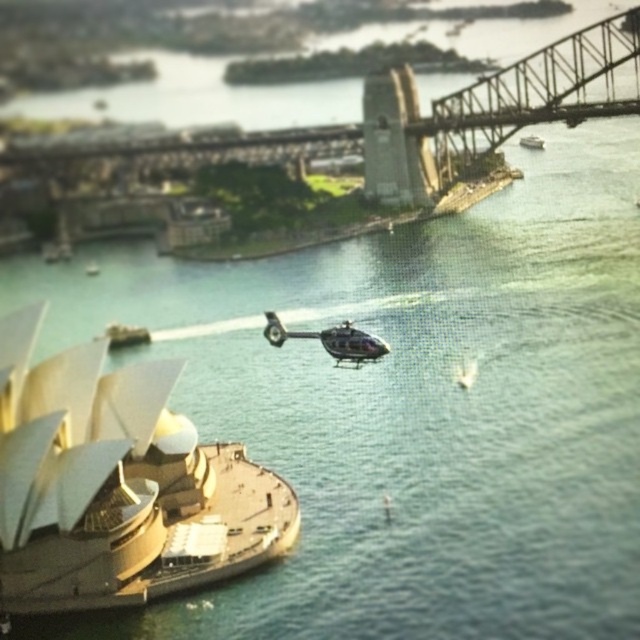
Question: Can you confirm if shiny silver boat at center is positioned to the left of white plastic boat at lower left?

Choices:
 (A) no
 (B) yes

Answer: (A)

Question: Among these objects, which one is nearest to the camera?

Choices:
 (A) white plastic boat at upper right
 (B) shiny silver boat at center
 (C) metallic helicopter at center

Answer: (B)

Question: Which of the following is the farthest from the observer?

Choices:
 (A) (x=387, y=349)
 (B) (x=132, y=333)
 (C) (x=86, y=272)

Answer: (C)

Question: In this image, where is metallic helicopter at center located relative to metallic silver boat at lower left?

Choices:
 (A) above
 (B) below

Answer: (B)

Question: Is metallic helicopter at center closer to the viewer compared to white plastic boat at upper right?

Choices:
 (A) no
 (B) yes

Answer: (B)

Question: Which point is closer to the camera taking this photo?

Choices:
 (A) (369, 348)
 (B) (97, 538)

Answer: (B)